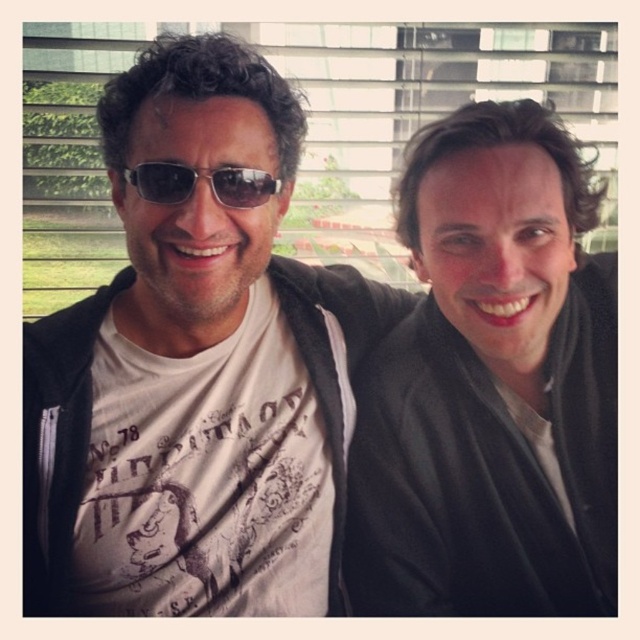
Who is lower down, matte black jacket at left or black plastic sunglasses at center?

Positioned lower is matte black jacket at left.

Measure the distance between point (145, 577) and camera.

Point (145, 577) is 36.72 inches away from camera.

Between point (90, 499) and point (266, 202), which one is positioned behind?

The point (90, 499) is behind.

Where is `matte black jacket at left`? matte black jacket at left is located at coordinates (195, 372).

Between matte black jacket at center and black plastic sunglasses at center, which one is positioned lower?

Positioned lower is matte black jacket at center.

Can you confirm if matte black jacket at center is shorter than black plastic sunglasses at center?

No.

Which is in front, point (460, 352) or point (138, 168)?

Positioned in front is point (138, 168).

At what (x,y) coordinates should I click in order to perform the action: click on matte black jacket at center. Please return your answer as a coordinate pair (x, y). This screenshot has height=640, width=640. Looking at the image, I should click on (492, 385).

Is matte black jacket at left above matte black jacket at center?

Yes, matte black jacket at left is above matte black jacket at center.

Where is `matte black jacket at left`? This screenshot has height=640, width=640. matte black jacket at left is located at coordinates (195, 372).